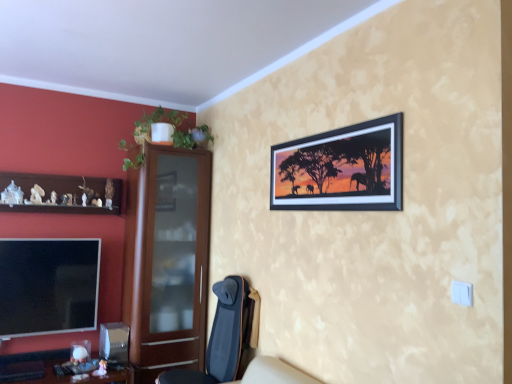
Question: Should I look upward or downward to see flat screen tv at lower left?

Choices:
 (A) down
 (B) up

Answer: (A)

Question: From the image's perspective, is brown wooden shelf at left beneath flat screen tv at lower left?

Choices:
 (A) no
 (B) yes

Answer: (A)

Question: Can you confirm if brown wooden shelf at left is thinner than flat screen tv at lower left?

Choices:
 (A) no
 (B) yes

Answer: (A)

Question: Is brown wooden shelf at left to the left of flat screen tv at lower left from the viewer's perspective?

Choices:
 (A) yes
 (B) no

Answer: (B)

Question: Is brown wooden shelf at left touching flat screen tv at lower left?

Choices:
 (A) yes
 (B) no

Answer: (B)

Question: Is flat screen tv at lower left at the back of brown wooden shelf at left?

Choices:
 (A) no
 (B) yes

Answer: (A)

Question: Does brown wooden shelf at left appear on the right side of flat screen tv at lower left?

Choices:
 (A) yes
 (B) no

Answer: (A)

Question: Does flat screen tv at lower left have a greater height compared to green leafy plant at upper left?

Choices:
 (A) no
 (B) yes

Answer: (B)

Question: Does flat screen tv at lower left have a smaller size compared to green leafy plant at upper left?

Choices:
 (A) no
 (B) yes

Answer: (B)

Question: From the image's perspective, is flat screen tv at lower left under green leafy plant at upper left?

Choices:
 (A) yes
 (B) no

Answer: (A)

Question: Considering the relative sizes of flat screen tv at lower left and green leafy plant at upper left in the image provided, is flat screen tv at lower left wider than green leafy plant at upper left?

Choices:
 (A) no
 (B) yes

Answer: (A)

Question: Is flat screen tv at lower left far from green leafy plant at upper left?

Choices:
 (A) yes
 (B) no

Answer: (A)

Question: Does flat screen tv at lower left come behind green leafy plant at upper left?

Choices:
 (A) no
 (B) yes

Answer: (B)

Question: Can you confirm if black matte picture frame at upper right is smaller than brown wooden shelf at left?

Choices:
 (A) no
 (B) yes

Answer: (B)